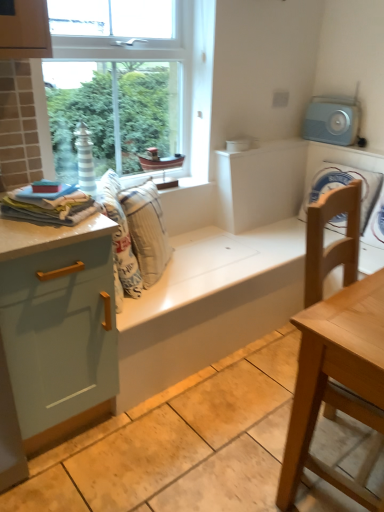
Question: Considering the relative sizes of light wood table at right and light blue glossy cabinet at left in the image provided, is light wood table at right shorter than light blue glossy cabinet at left?

Choices:
 (A) yes
 (B) no

Answer: (B)

Question: Can you confirm if light wood table at right is smaller than light blue glossy cabinet at left?

Choices:
 (A) no
 (B) yes

Answer: (B)

Question: Is light wood table at right placed right next to light blue glossy cabinet at left?

Choices:
 (A) no
 (B) yes

Answer: (A)

Question: From a real-world perspective, does light wood table at right stand above light blue glossy cabinet at left?

Choices:
 (A) yes
 (B) no

Answer: (A)

Question: Can you confirm if light wood table at right is taller than light blue glossy cabinet at left?

Choices:
 (A) yes
 (B) no

Answer: (A)

Question: Is light blue glossy cabinet at left to the left or to the right of soft cotton towels at left, which is the second material from right to left, in the image?

Choices:
 (A) right
 (B) left

Answer: (B)

Question: In terms of size, does light blue glossy cabinet at left appear bigger or smaller than soft cotton towels at left, arranged as the 1th material when viewed from the left?

Choices:
 (A) big
 (B) small

Answer: (A)

Question: Is light blue glossy cabinet at left in front of or behind soft cotton towels at left, the 1th material positioned from the front, in the image?

Choices:
 (A) front
 (B) behind

Answer: (A)

Question: From the image's perspective, relative to soft cotton towels at left, which is the second material from right to left, is light blue glossy cabinet at left above or below?

Choices:
 (A) above
 (B) below

Answer: (B)

Question: Looking at their shapes, would you say white fabric washing machine at right is wider or thinner than white matte cabinet at center?

Choices:
 (A) thin
 (B) wide

Answer: (A)

Question: Relative to white matte cabinet at center, is white fabric washing machine at right in front or behind?

Choices:
 (A) front
 (B) behind

Answer: (A)

Question: In terms of height, does white fabric washing machine at right look taller or shorter compared to white matte cabinet at center?

Choices:
 (A) short
 (B) tall

Answer: (B)

Question: Is point (375, 254) positioned closer to the camera than point (223, 190)?

Choices:
 (A) farther
 (B) closer

Answer: (B)

Question: Is point (306, 137) positioned closer to the camera than point (228, 202)?

Choices:
 (A) farther
 (B) closer

Answer: (A)

Question: In terms of width, does light blue plastic radio at upper right look wider or thinner when compared to white matte cabinet at center?

Choices:
 (A) thin
 (B) wide

Answer: (A)